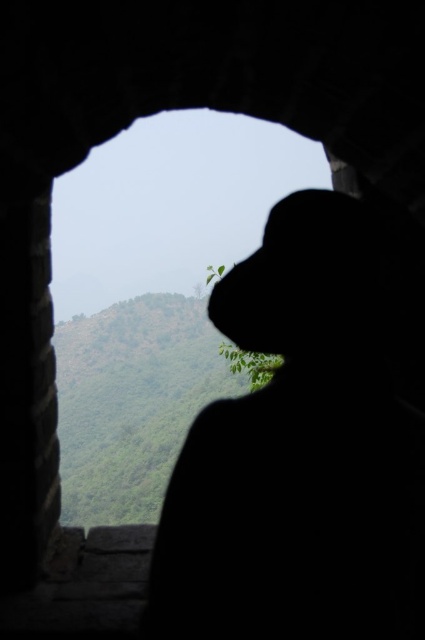
You are an architect designing a new building and want to incorporate both the silhouette hat at center and the transparent glass window at center into your design. Based on the image, which of these two elements is narrower?

The silhouette hat at center is thinner than the transparent glass window at center, so the silhouette hat at center is narrower.

You are an architect designing a new building and want to incorporate elements from this scene. If you want to emphasize the silhouette hat at center in your design, how does its size compare to the transparent glass window at center in the image?

The silhouette hat at center occupies less space than the transparent glass window at center, so in your design, you can make the silhouette hat at center smaller than the transparent glass window at center to maintain the same proportion.